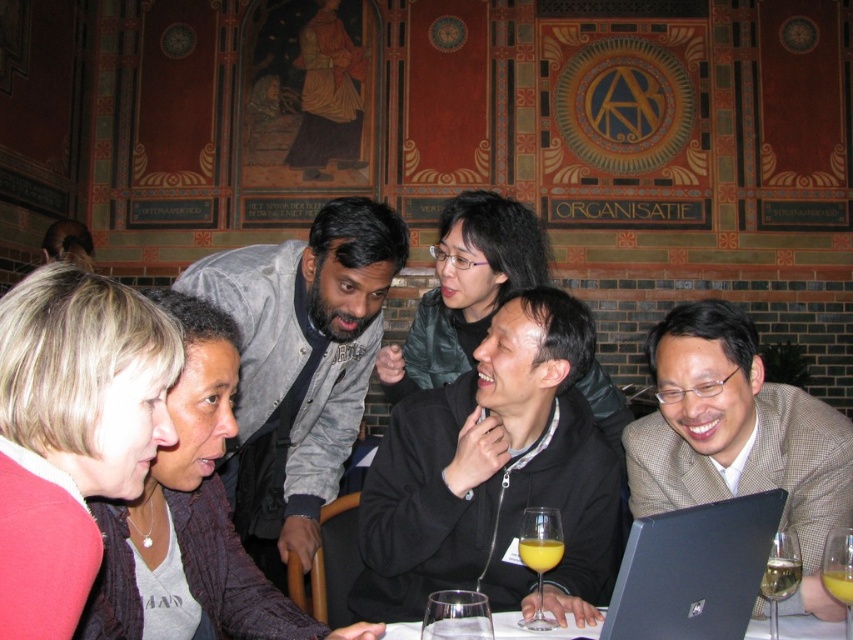
Can you confirm if translucent glass wine glass at lower right is wider than translucent yellow liquid at center?

Correct, the width of translucent glass wine glass at lower right exceeds that of translucent yellow liquid at center.

Can you confirm if translucent glass wine glass at lower right is bigger than translucent yellow liquid at center?

Yes.

Find the location of `translucent glass wine glass at lower right`. translucent glass wine glass at lower right is located at coordinates click(x=839, y=570).

The width and height of the screenshot is (853, 640). Find the location of `translucent glass wine glass at lower right`. translucent glass wine glass at lower right is located at coordinates (839, 570).

Can you confirm if gray fleece jacket at upper left is bigger than yellow translucent liquid at lower right?

Indeed, gray fleece jacket at upper left has a larger size compared to yellow translucent liquid at lower right.

Between gray fleece jacket at upper left and yellow translucent liquid at lower right, which one appears on the right side from the viewer's perspective?

yellow translucent liquid at lower right is more to the right.

Between point (300, 292) and point (833, 568), which one is positioned in front?

Positioned in front is point (833, 568).

Identify the location of gray fleece jacket at upper left. (300, 365).

Where is `black matte jacket at center`? black matte jacket at center is located at coordinates (494, 476).

Describe the element at coordinates (494, 476) in the screenshot. The image size is (853, 640). I see `black matte jacket at center` at that location.

Locate an element on the screen. black matte jacket at center is located at coordinates (494, 476).